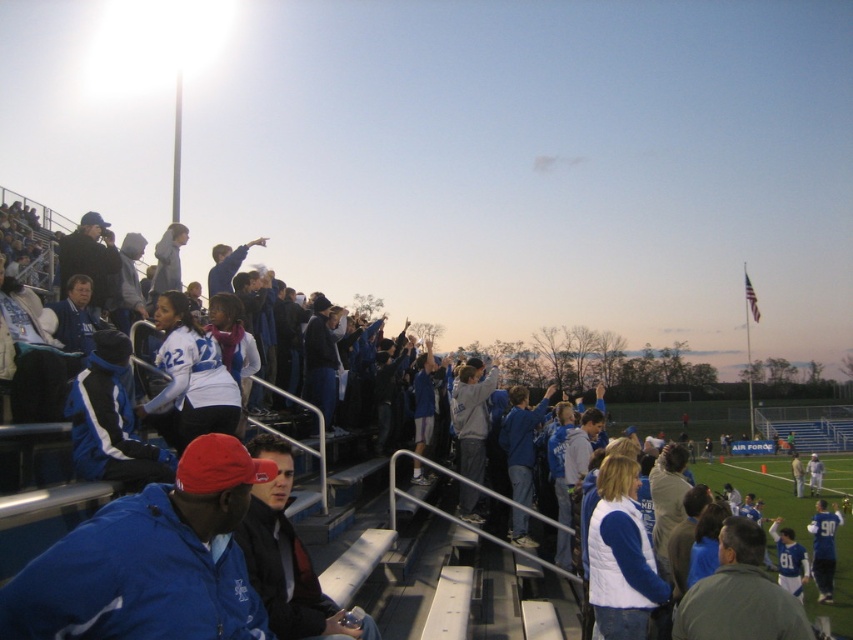
You are a photographer at the sports event. You need to capture a photo of the blue fabric jacket at center without including the blue matte jacket at lower left in the frame. Is this possible based on their positions?

The blue matte jacket at lower left is located below the blue fabric jacket at center, so if you position your camera to focus on the blue fabric jacket at center and avoid the lower area where the blue matte jacket at lower left is, it should be possible to exclude it from the frame.

You are standing at the point labeled point (166,570) and want to throw a ball to a friend who is 14 meters away from you. Can you reach them if your throwing range is exactly 14 meters?

Yes, since the distance between you and your friend is exactly 14 meters, which matches your throwing range, so you can reach them.

You are a photographer trying to capture a wide shot of the entire scene. You notice two jackets in the foreground that might block the view of the field. The blue matte jacket at lower left and the blue fabric jacket at center are both in your frame. Which jacket is smaller and less likely to obstruct the view?

The blue matte jacket at lower left is smaller and occupies less space than the blue fabric jacket at center, making it less likely to obstruct the view.